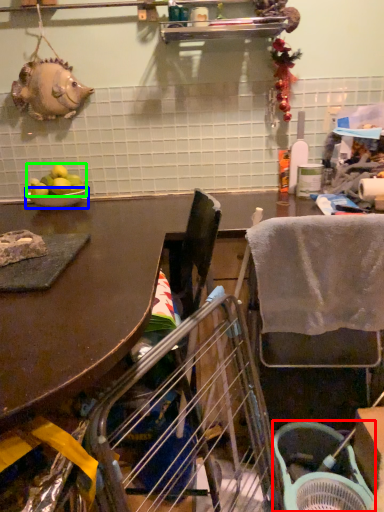
Question: Based on their relative distances, which object is nearer to basket (highlighted by a red box)? Choose from bowl (highlighted by a blue box) and fruit (highlighted by a green box).

Choices:
 (A) bowl
 (B) fruit

Answer: (A)